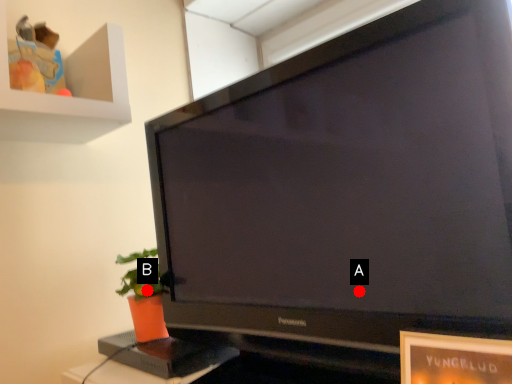
Question: Two points are circled on the image, labeled by A and B beside each circle. Among these points, which one is farthest from the camera?

Choices:
 (A) A is further
 (B) B is further

Answer: (B)